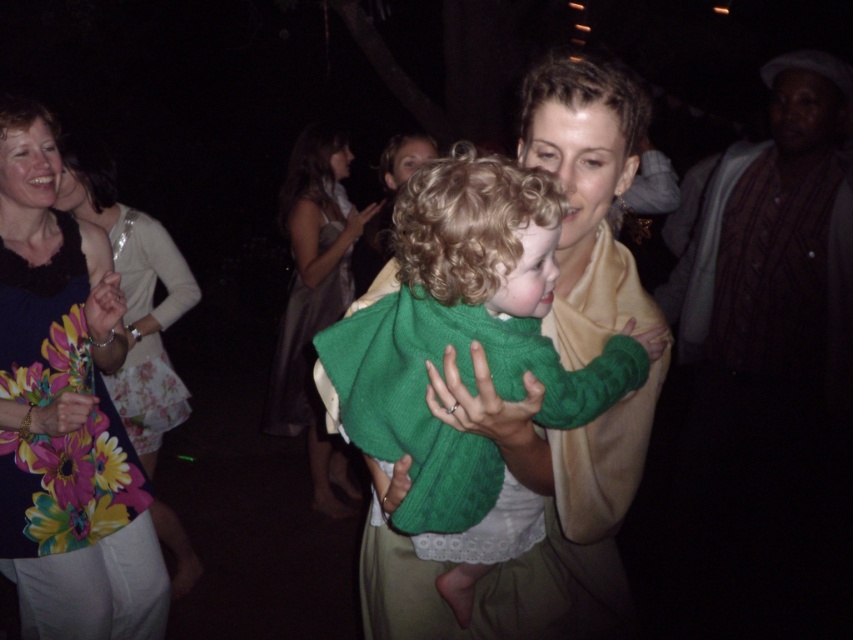
Question: Is floral dress at left smaller than silky beige dress at center?

Choices:
 (A) yes
 (B) no

Answer: (A)

Question: Is the position of green knitted sweater at center more distant than that of silky beige dress at center?

Choices:
 (A) yes
 (B) no

Answer: (B)

Question: Estimate the real-world distances between objects in this image. Which object is farther from the silky beige dress at center?

Choices:
 (A) floral dress at left
 (B) green knitted sweater at center

Answer: (B)

Question: Can you confirm if green knitted sweater at center is positioned to the left of silky beige dress at center?

Choices:
 (A) no
 (B) yes

Answer: (A)

Question: Which point is closer to the camera taking this photo?

Choices:
 (A) pos(318,172)
 (B) pos(630,346)

Answer: (B)

Question: Which point is farther from the camera taking this photo?

Choices:
 (A) (306, 205)
 (B) (9, 157)
 (C) (405, 369)

Answer: (A)